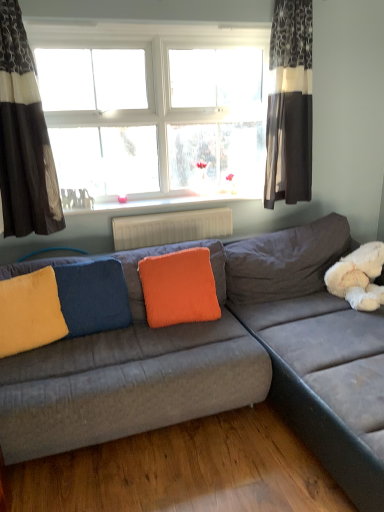
Where is `blank space situated above white plastic radiator at center (from a real-world perspective)`? blank space situated above white plastic radiator at center (from a real-world perspective) is located at coordinates (173, 211).